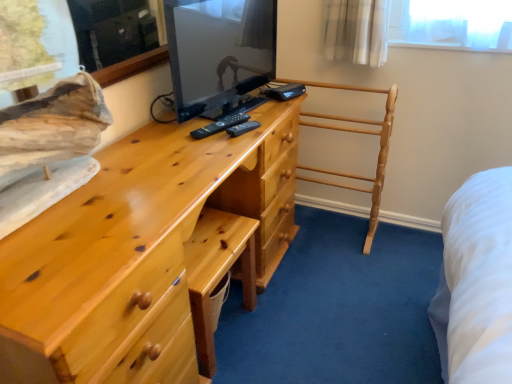
Locate an element on the screen. This screenshot has width=512, height=384. free location in front of light brown wooden towel rack at center is located at coordinates (348, 288).